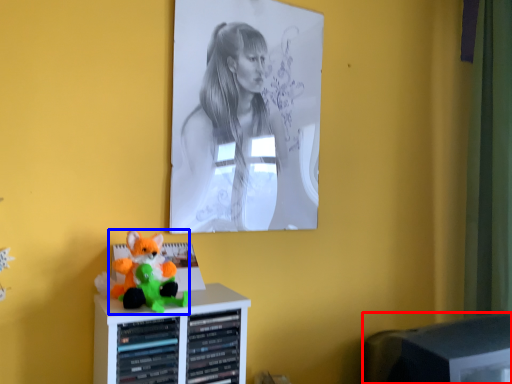
Question: Which point is further to the camera, computer monitor (highlighted by a red box) or toy (highlighted by a blue box)?

Choices:
 (A) computer monitor
 (B) toy

Answer: (A)